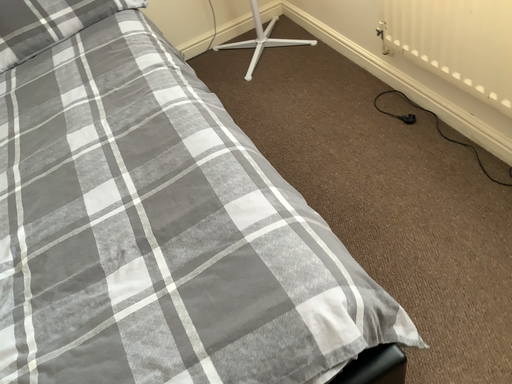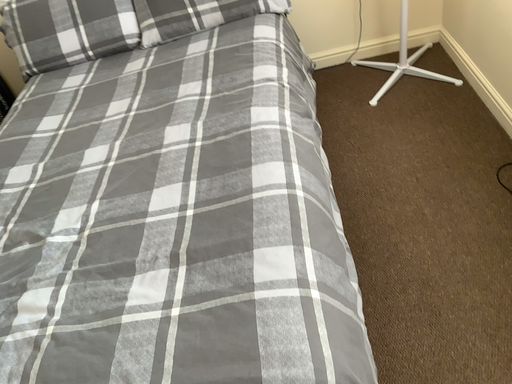
Question: Which way did the camera rotate in the video?

Choices:
 (A) rotated right
 (B) rotated left

Answer: (B)